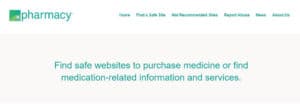
Image resolution: width=300 pixels, height=104 pixels. What are the coordinates of `safe` in the screenshot? It's located at (79, 66).